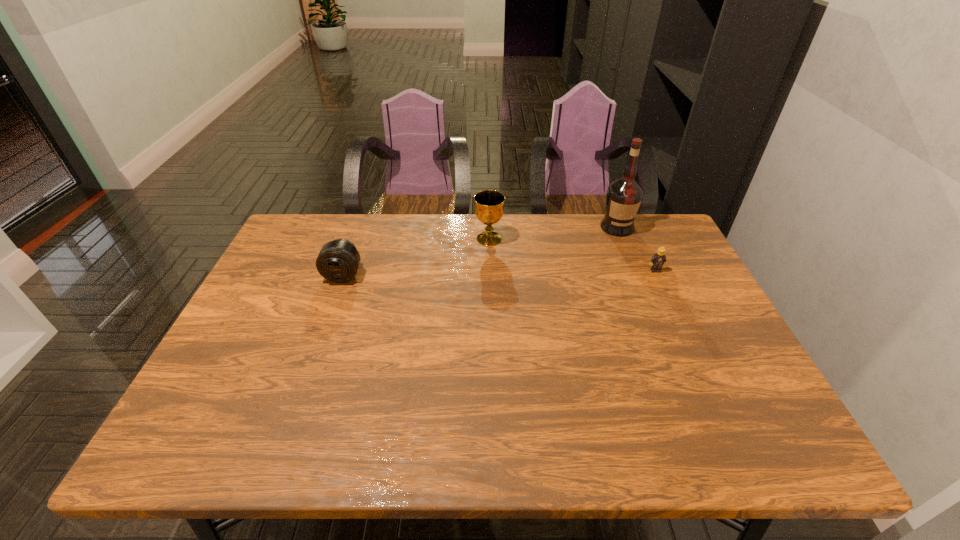
Where is `free space at the far right corner`? This screenshot has height=540, width=960. free space at the far right corner is located at coordinates (661, 233).

You are a GUI agent. You are given a task and a screenshot of the screen. Output one action in this format:
    pyautogui.click(x=<x>, y=<y>)
    Task: Click on the free point between the leftmost object and the shortest object
    
    Given the screenshot: What is the action you would take?
    pyautogui.click(x=499, y=273)

The image size is (960, 540). I want to click on blank region between the tallest object and the leftmost object, so click(480, 251).

Find the location of a particular element. This screenshot has height=540, width=960. free space between the second shortest object and the Lego is located at coordinates (499, 273).

This screenshot has height=540, width=960. In order to click on vacant point located between the third tallest object and the chalice in this screenshot , I will do `click(416, 257)`.

The height and width of the screenshot is (540, 960). What are the coordinates of `free space between the third object from right to left and the tallest object` in the screenshot? It's located at (553, 233).

Identify the location of unoccupied area between the telephoto lens and the shortest object. pos(499,273).

This screenshot has height=540, width=960. Find the location of `empty location between the third shortest object and the shortest object`. empty location between the third shortest object and the shortest object is located at coordinates (572, 254).

I want to click on vacant area between the third tallest object and the chalice, so click(x=416, y=257).

In order to click on vacant region between the chalice and the Lego in this screenshot , I will do `click(572, 254)`.